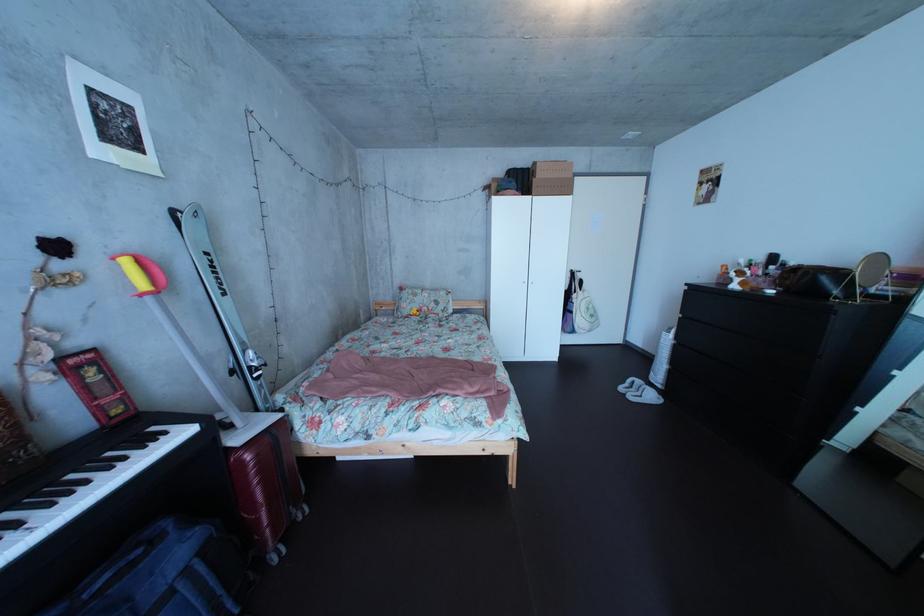
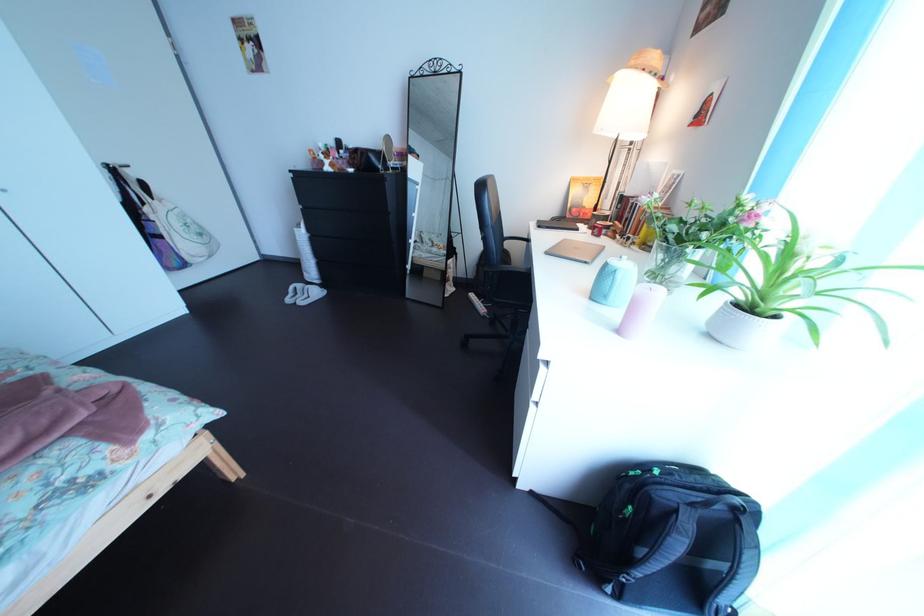
In the second image, find the point that corresponds to [605,320] in the first image.

(209, 237)